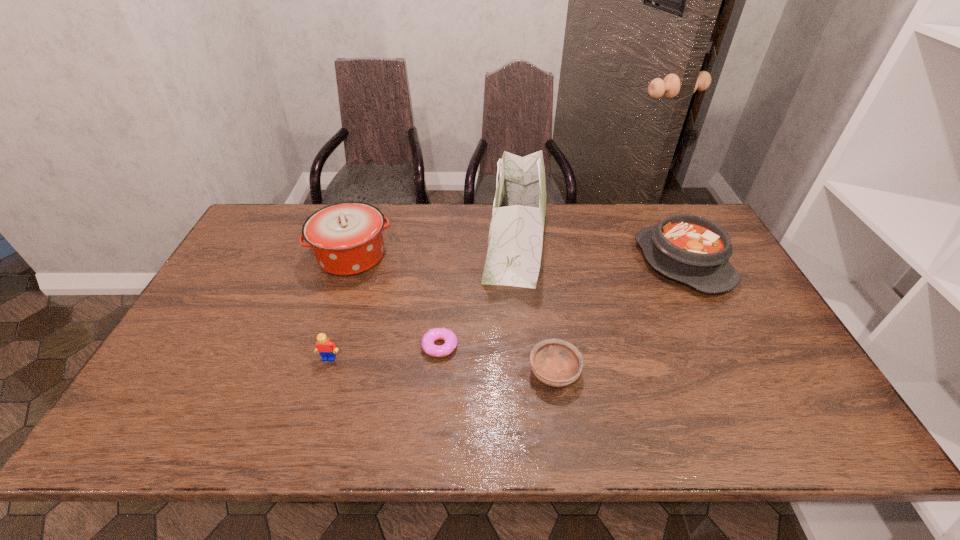
The height and width of the screenshot is (540, 960). Find the location of `the tallest object`. the tallest object is located at coordinates (515, 242).

Locate an element on the screen. This screenshot has height=540, width=960. the second tallest object is located at coordinates click(346, 238).

What are the coordinates of `the left casserole` in the screenshot? It's located at (346, 238).

I want to click on the shorter casserole, so click(x=694, y=250).

Where is `the rightmost object`? the rightmost object is located at coordinates (694, 250).

Where is `the fourth tallest object`? the fourth tallest object is located at coordinates (x=326, y=348).

Locate an element on the screen. The width and height of the screenshot is (960, 540). bowl is located at coordinates (557, 363).

You are a GUI agent. You are given a task and a screenshot of the screen. Output one action in this format:
    pyautogui.click(x=<x>, y=<y>)
    Task: Click on the doughnut
    The width and height of the screenshot is (960, 540).
    Given the screenshot: What is the action you would take?
    pyautogui.click(x=432, y=335)

Locate an element on the screen. the shortest object is located at coordinates 432,335.

Where is `free region located 0.220m on the left of the tallest object`? The width and height of the screenshot is (960, 540). free region located 0.220m on the left of the tallest object is located at coordinates (413, 244).